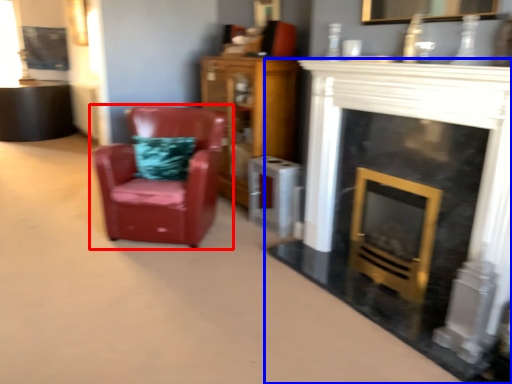
Question: Among these objects, which one is farthest to the camera, chair (highlighted by a red box) or fireplace (highlighted by a blue box)?

Choices:
 (A) chair
 (B) fireplace

Answer: (A)